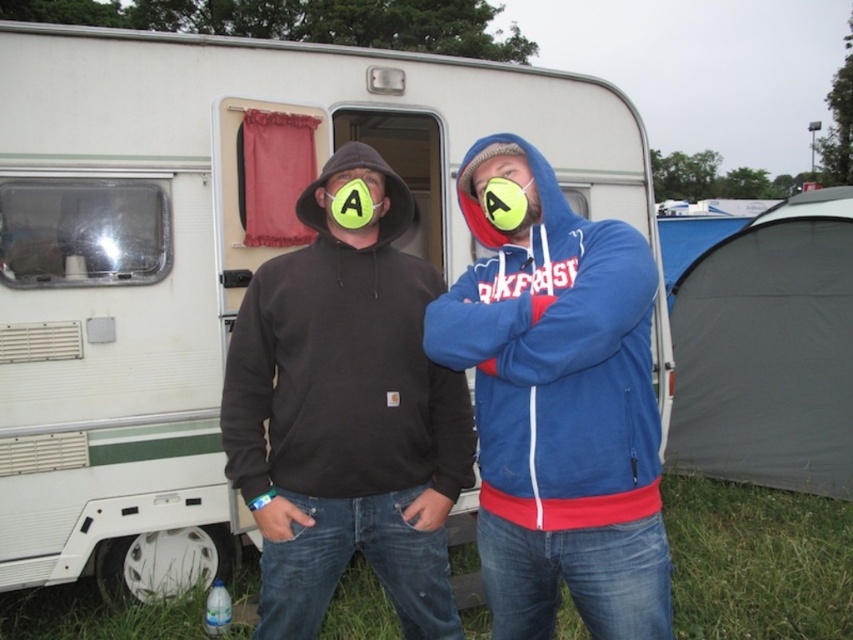
Question: Which of the following is the closest to the observer?

Choices:
 (A) (369, 225)
 (B) (149, 291)

Answer: (A)

Question: Estimate the real-world distances between objects in this image. Which object is closer to the blue fleece jacket at center?

Choices:
 (A) dark brown hoodie at center
 (B) matte yellow mask at center

Answer: (B)

Question: Does blue fleece jacket at center have a greater width compared to matte yellow mask at center?

Choices:
 (A) yes
 (B) no

Answer: (A)

Question: Considering the relative positions of matte yellow mask at center and matte black hoodie at center in the image provided, where is matte yellow mask at center located with respect to matte black hoodie at center?

Choices:
 (A) left
 (B) right

Answer: (B)

Question: Which object is closer to the camera taking this photo?

Choices:
 (A) matte black hoodie at center
 (B) dark gray fabric tent at right
 (C) white plastic trailer at center
 (D) blue fleece jacket at center

Answer: (D)

Question: Can you confirm if dark brown hoodie at center is wider than matte yellow mask at center?

Choices:
 (A) no
 (B) yes

Answer: (B)